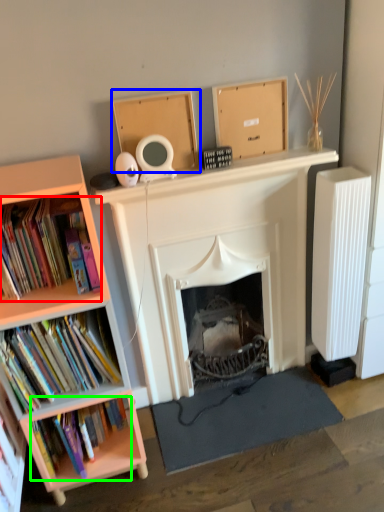
Question: Considering the real-world distances, which object is closest to book (highlighted by a red box)? cardboard box (highlighted by a blue box) or book (highlighted by a green box).

Choices:
 (A) cardboard box
 (B) book

Answer: (A)